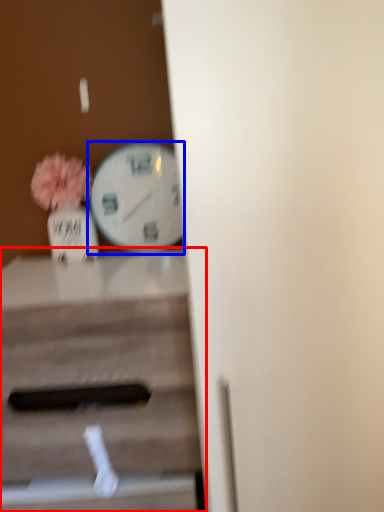
Question: Which of the following is the closest to the observer, table (highlighted by a red box) or wall clock (highlighted by a blue box)?

Choices:
 (A) table
 (B) wall clock

Answer: (A)